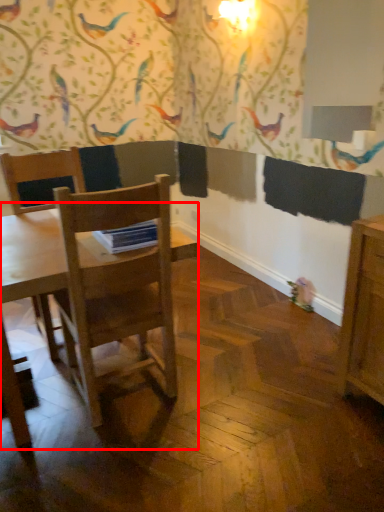
Question: From the image's perspective, considering the relative positions of table (annotated by the red box) and chair in the image provided, where is table (annotated by the red box) located with respect to the staircase?

Choices:
 (A) above
 (B) below

Answer: (B)